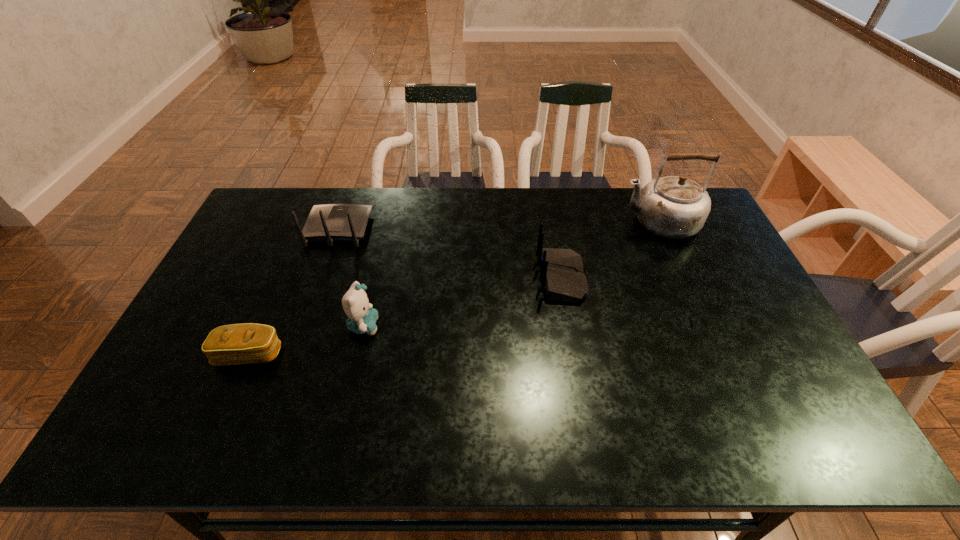
This screenshot has height=540, width=960. What are the coordinates of `the rightmost object` in the screenshot? It's located at (675, 207).

You are a GUI agent. You are given a task and a screenshot of the screen. Output one action in this format:
    pyautogui.click(x=<x>, y=<y>)
    Task: Click on the kettle
    This screenshot has width=960, height=540.
    Given the screenshot: What is the action you would take?
    pyautogui.click(x=675, y=207)

Where is `the left router`? This screenshot has height=540, width=960. the left router is located at coordinates (331, 222).

The image size is (960, 540). What are the coordinates of `the third farthest object` in the screenshot? It's located at (562, 276).

Where is `the right router`? The width and height of the screenshot is (960, 540). the right router is located at coordinates (562, 276).

Find the location of a particular element. kitten is located at coordinates (362, 317).

Where is `clutch bag`? Image resolution: width=960 pixels, height=540 pixels. clutch bag is located at coordinates (245, 343).

The image size is (960, 540). In order to click on vacant region located 0.230m at the spout of the kettle in this screenshot , I will do `click(553, 222)`.

Identify the location of blank area located 0.170m at the spout of the kettle. Image resolution: width=960 pixels, height=540 pixels. (570, 222).

The image size is (960, 540). What are the coordinates of `vacant space located 0.400m at the spout of the kettle` in the screenshot? It's located at (505, 222).